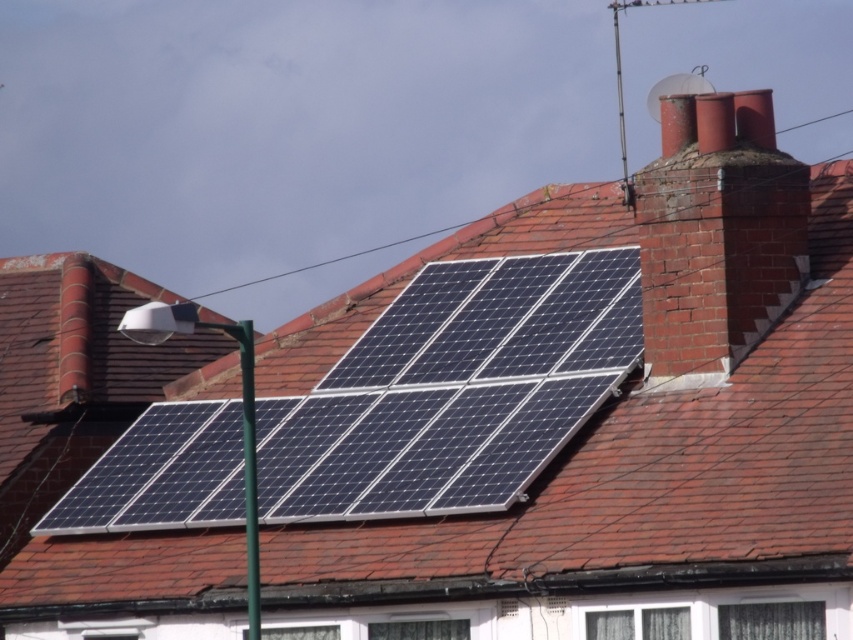
Question: Considering the relative positions of dark blue solar panels at center and red brick chimney at upper right in the image provided, where is dark blue solar panels at center located with respect to red brick chimney at upper right?

Choices:
 (A) right
 (B) left

Answer: (B)

Question: Which point is closer to the camera taking this photo?

Choices:
 (A) (467, 294)
 (B) (706, 362)

Answer: (B)

Question: Considering the relative positions of dark blue solar panels at center and red brick chimney at upper right in the image provided, where is dark blue solar panels at center located with respect to red brick chimney at upper right?

Choices:
 (A) below
 (B) above

Answer: (A)

Question: Does dark blue solar panels at center have a larger size compared to red brick chimney at upper right?

Choices:
 (A) yes
 (B) no

Answer: (A)

Question: Which point is farther from the camera taking this photo?

Choices:
 (A) (689, 125)
 (B) (97, 296)

Answer: (B)

Question: Which point is closer to the camera taking this photo?

Choices:
 (A) (679, 344)
 (B) (706, 460)

Answer: (B)